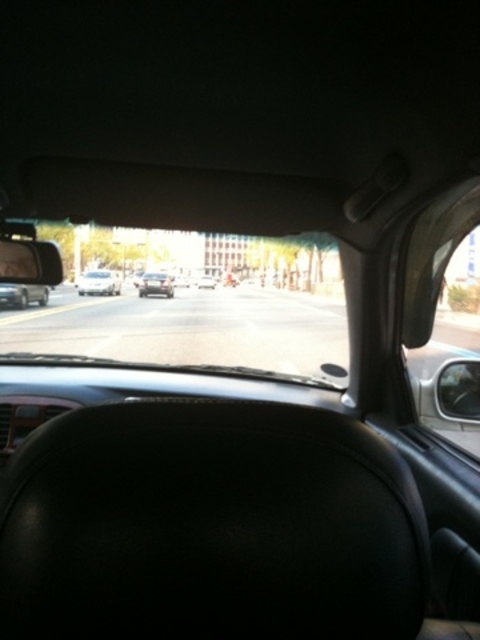
Question: Is black leather dashboard at center wider than matte black view mirror at left?

Choices:
 (A) yes
 (B) no

Answer: (A)

Question: Which of the following is the closest to the observer?

Choices:
 (A) matte black car at left
 (B) matte black view mirror at left
 (C) black glossy sedan at center

Answer: (B)

Question: Can you confirm if black leather dashboard at center is positioned above matte black car at left?

Choices:
 (A) no
 (B) yes

Answer: (A)

Question: Estimate the real-world distances between objects in this image. Which object is farther from the black leather dashboard at center?

Choices:
 (A) shiny silver sedan at center
 (B) transparent glass windshield at center
 (C) matte black car at left

Answer: (A)

Question: Is transparent glass windshield at center thinner than matte black view mirror at left?

Choices:
 (A) no
 (B) yes

Answer: (A)

Question: Which point appears closest to the camera in this image?

Choices:
 (A) (320, 496)
 (B) (332, 330)
 (C) (45, 304)
 (D) (204, 285)

Answer: (A)